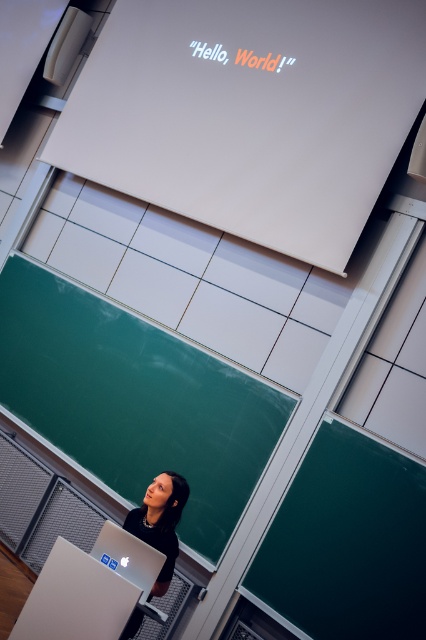
Is white glossy projector screen at upper center to the right of green matte/blackboard at lower right from the viewer's perspective?

Incorrect, white glossy projector screen at upper center is not on the right side of green matte/blackboard at lower right.

Which of these two, white glossy projector screen at upper center or green matte/blackboard at lower right, stands shorter?

With less height is green matte/blackboard at lower right.

Measure the distance between white glossy projector screen at upper center and camera.

white glossy projector screen at upper center is 3.30 meters from camera.

The height and width of the screenshot is (640, 426). I want to click on white glossy projector screen at upper center, so click(250, 113).

Between white glossy projector screen at upper center and matte black laptop at lower center, which one appears on the right side from the viewer's perspective?

white glossy projector screen at upper center is more to the right.

Does point (336, 115) lie behind point (155, 541)?

Yes, it is.

Where is `white glossy projector screen at upper center`? Image resolution: width=426 pixels, height=640 pixels. white glossy projector screen at upper center is located at coordinates coord(250,113).

Looking at this image, does white glossy projector screen at upper center appear over green chalkboard at lower left?

Correct, white glossy projector screen at upper center is located above green chalkboard at lower left.

Can you confirm if white glossy projector screen at upper center is taller than green chalkboard at lower left?

Yes.

Which is behind, point (221, 33) or point (175, 440)?

The point (221, 33) is more distant.

This screenshot has width=426, height=640. I want to click on white glossy projector screen at upper center, so click(250, 113).